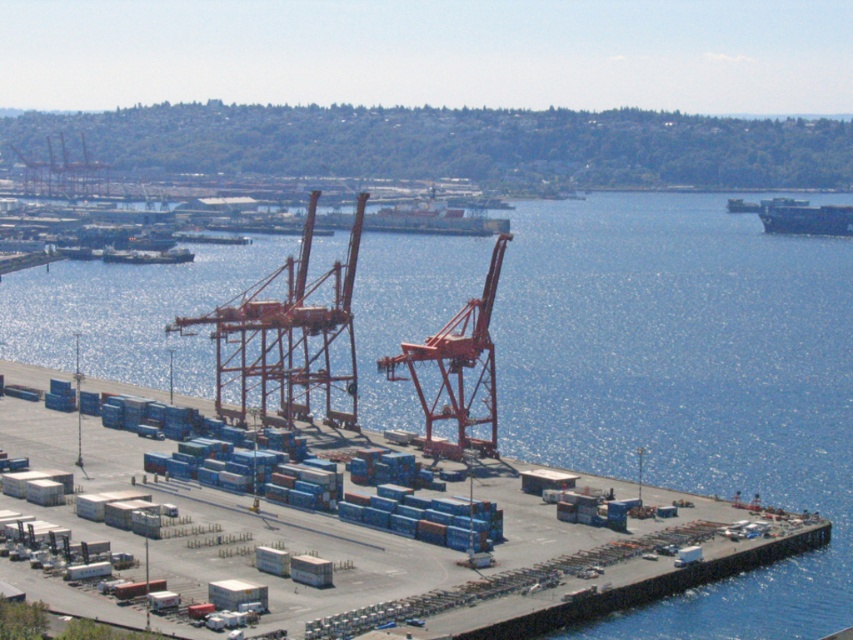
Looking at this image, you are a crane operator trying to load cargo onto the dark gray matte container ship at right. You need to lower a container onto the deck. Based on the scene, where should you position the container relative to the blue water at center?

The blue water at center is located below the dark gray matte container ship at right, so you should position the container on the deck of the dark gray matte container ship at right above the blue water at center to ensure it is placed correctly.

Consider the image. You are a crane operator trying to lower a container onto the dock. You notice the blue water at center and the metallic orange crane at center. Which object is directly above the other?

The metallic orange crane at center is directly above the blue water at center because the blue water at center is positioned under the metallic orange crane at center.

You are a crane operator standing at the center of the dock. You need to move a container from one point to another. The first point is point (415, 348) and the second point is point (82, 189). Which point is closer to you?

Point (415, 348) is in front of point (82, 189), so the first point is closer to you.